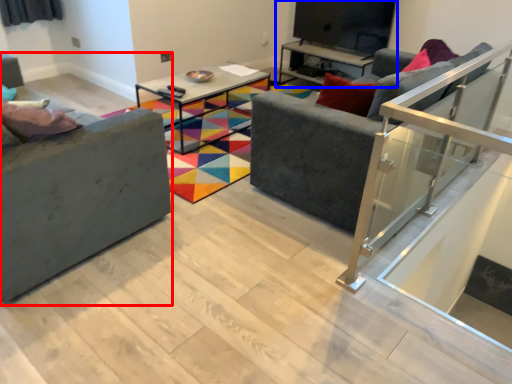
Question: Which point is closer to the camera, studio couch (highlighted by a red box) or entertainment center (highlighted by a blue box)?

Choices:
 (A) studio couch
 (B) entertainment center

Answer: (A)